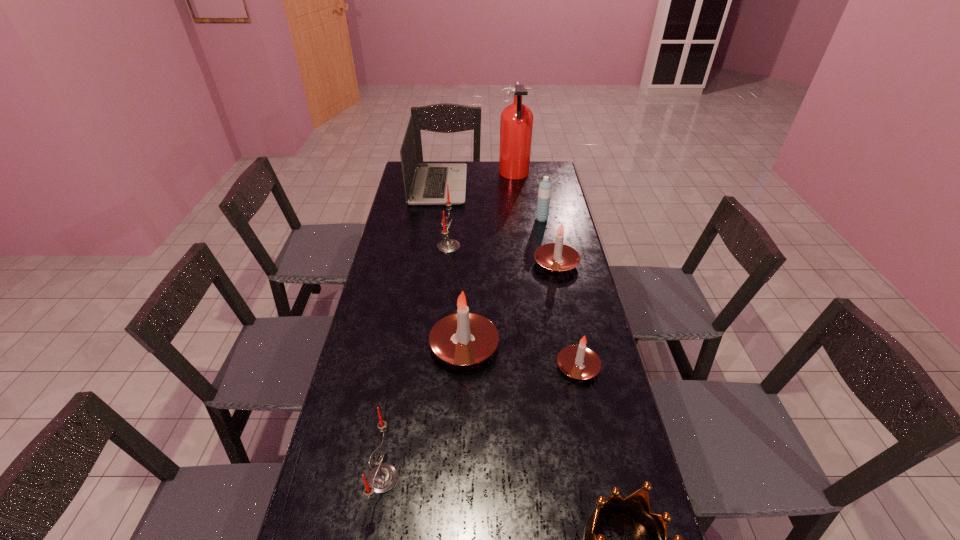
I want to click on fire extinguisher, so click(516, 124).

Where is `the eighth shortest object`? Image resolution: width=960 pixels, height=540 pixels. the eighth shortest object is located at coordinates (429, 185).

Where is `the biggest white candle`? the biggest white candle is located at coordinates (463, 338).

Find the location of `the right red candle`. the right red candle is located at coordinates (447, 245).

Where is `the bigger red candle`? The image size is (960, 540). the bigger red candle is located at coordinates (447, 245).

Locate an element on the screen. The image size is (960, 540). water bottle is located at coordinates (544, 193).

You are a GUI agent. You are given a task and a screenshot of the screen. Output one action in this format:
    pyautogui.click(x=<x>, y=<y>)
    Task: Click on the blue water bottle
    The width and height of the screenshot is (960, 540).
    Given the screenshot: What is the action you would take?
    pyautogui.click(x=544, y=193)

This screenshot has width=960, height=540. What are the coordinates of `the farthest white candle` in the screenshot? It's located at (557, 257).

Where is `the left red candle`? the left red candle is located at coordinates (382, 478).

In order to click on the smaller red candle in this screenshot , I will do `click(382, 478)`.